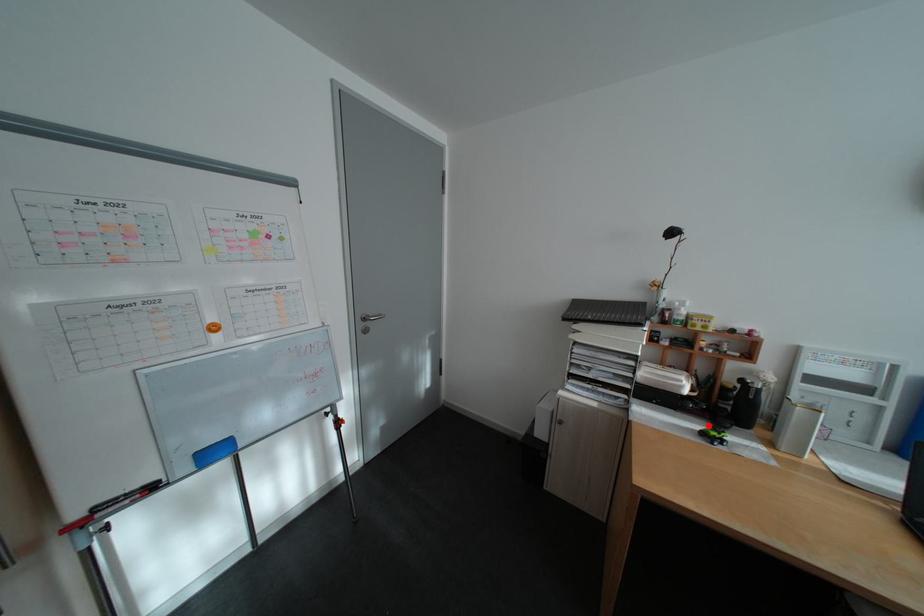
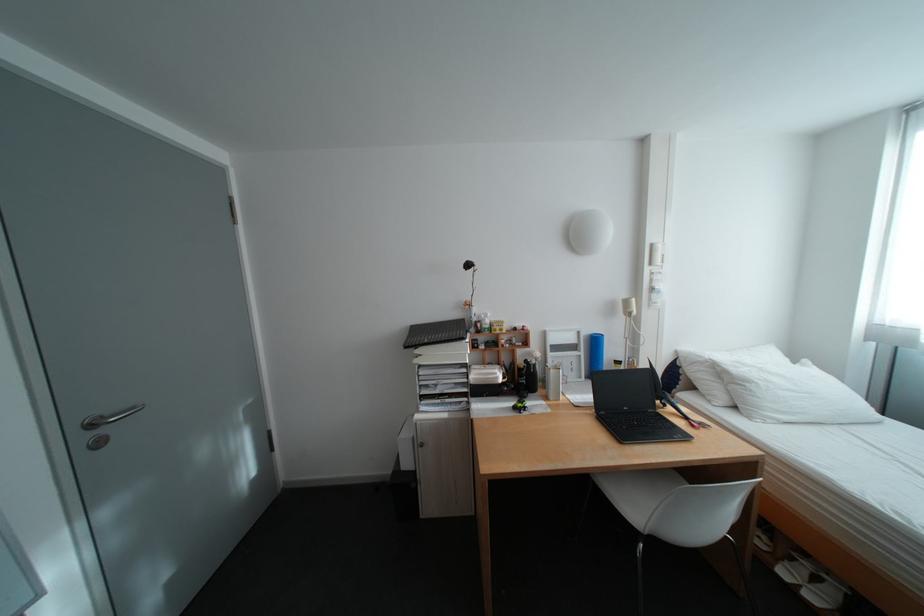
Locate, in the second image, the point that corresponds to the highlighted location in the first image.

(523, 403)